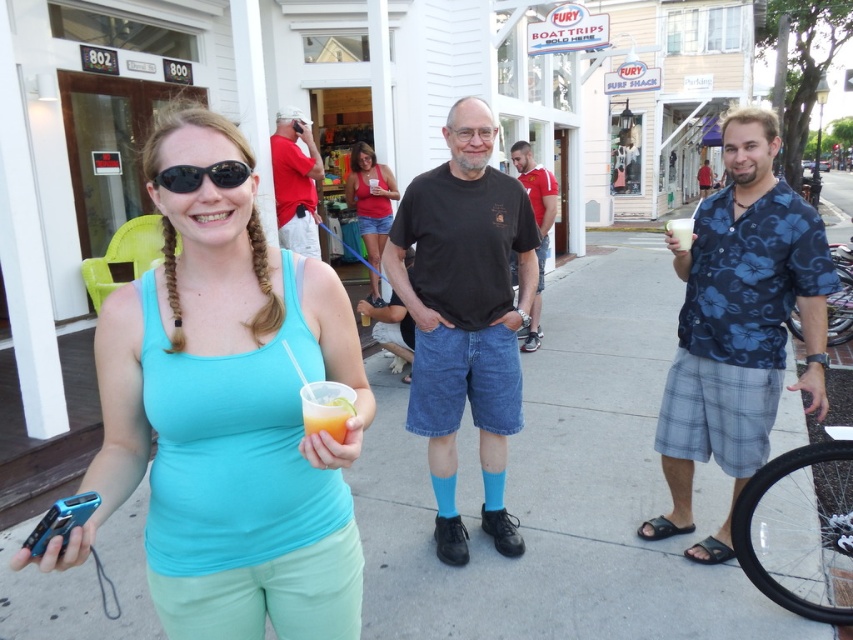
You are a photographer trying to capture a clear shot of the matte red shirt at center and the matte red tank top at center. Which one is positioned higher in the frame?

The matte red shirt at center is located above the matte red tank top at center, so it is positioned higher in the frame.